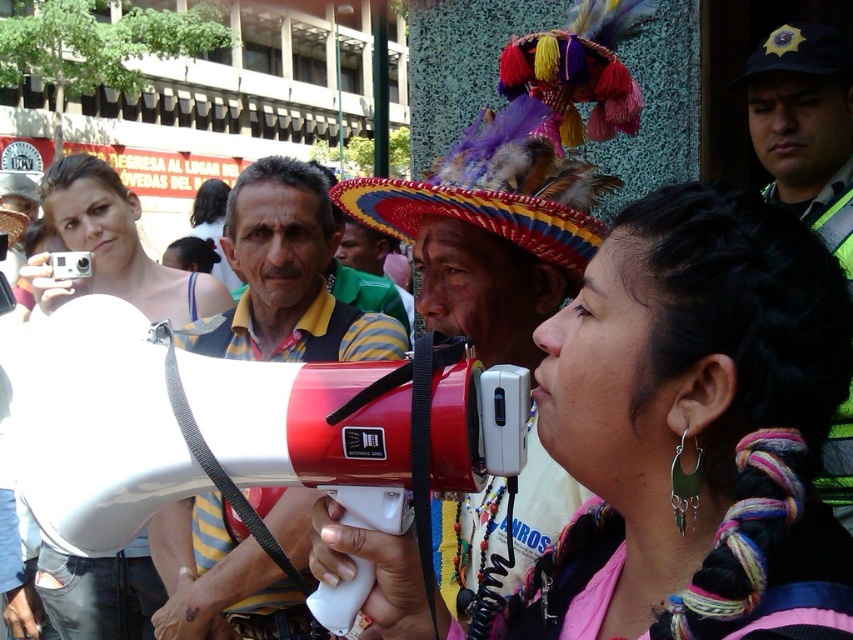
In the scene shown: You are organizing a community event and have two megaphones available. The red plastic megaphone at center and the matte white megaphone at center. Which one is larger and better suited for amplifying your voice to the crowd?

The red plastic megaphone at center is bigger than the matte white megaphone at center, so it is better suited for amplifying your voice to the crowd.

You are a photographer trying to capture the entire scene in one shot. The matte white megaphone at center and the reflective silver helmet at upper right are both important elements. Which object should you focus on first to ensure both are in frame?

The matte white megaphone at center is much taller than the reflective silver helmet at upper right, so you should focus on the matte white megaphone at center first to ensure both are in frame.

You are a photographer standing at the center of the scene. You want to take a photo of both point (204, 614) and point (74, 577). Which point will appear larger in your photo?

Point (204, 614) is closer to the camera than point (74, 577), so it will appear larger in the photo.